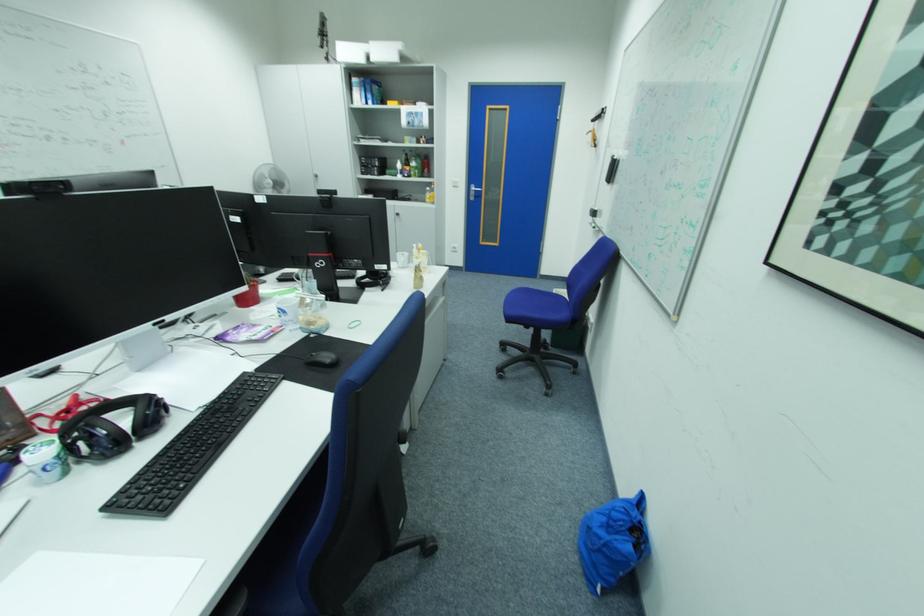
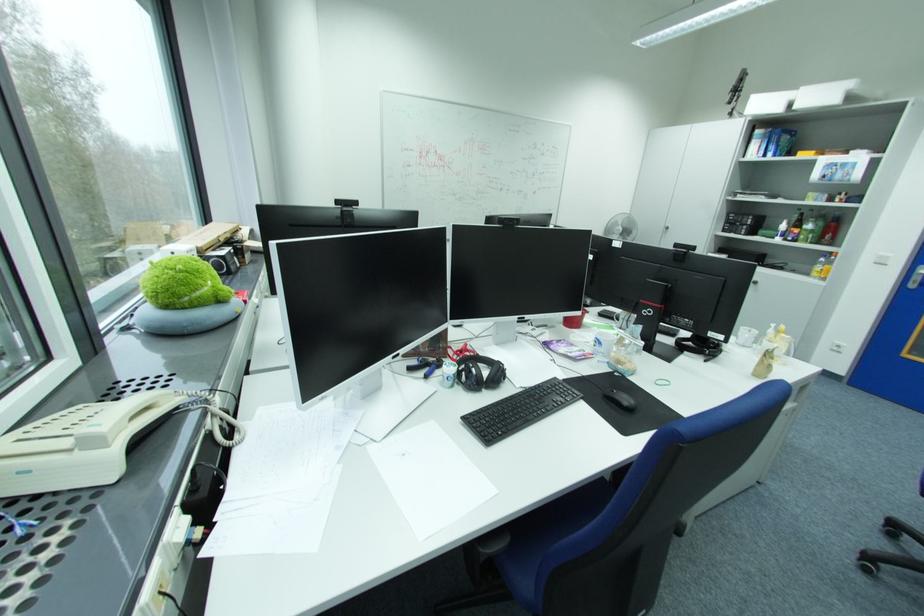
In the second image, find the point that corresponds to (x=52, y=448) in the first image.

(460, 367)